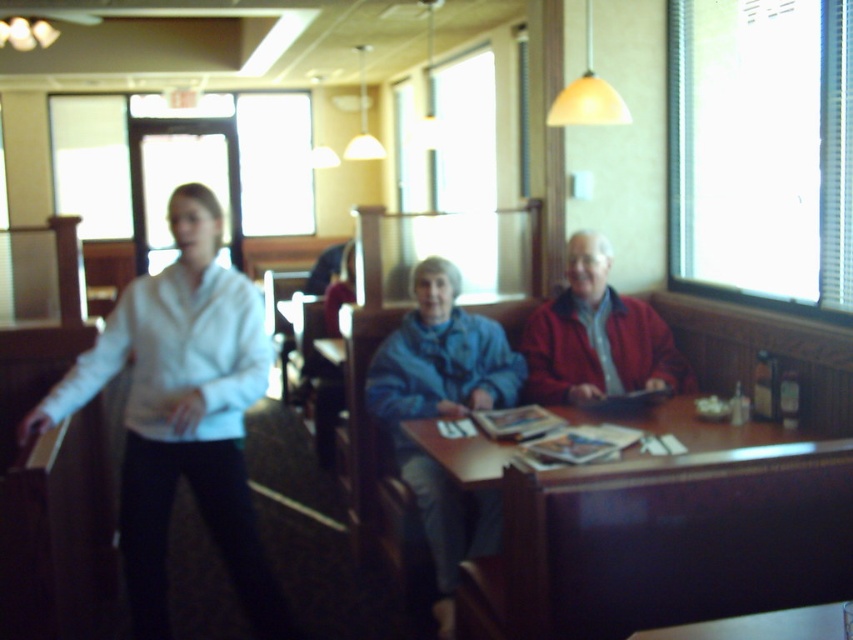
You are a waiter in a diner and you see the wooden table at center and the white matte shirt at left. Which object is closer to the floor?

The wooden table at center is located below white matte shirt at left, so it is closer to the floor.

You are a photographer trying to capture a candid shot of the white matte shirt at left and the red matte jacket at center. Since you want to ensure both are in focus, you need to know their relative sizes in the frame. Which object is wider in the image?

The white matte shirt at left is thinner than the red matte jacket at center, so the red matte jacket at center is wider in the image.